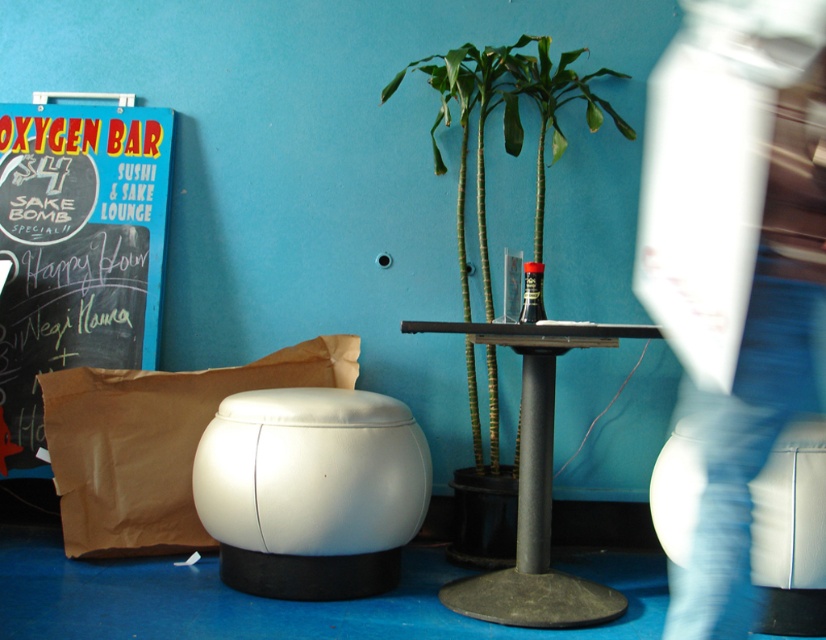
Question: Which object is farther from the camera taking this photo?

Choices:
 (A) black chalkboard at left
 (B) green leafy plant at center
 (C) brown paper bag at left

Answer: (A)

Question: Is white leather ottoman at center above metallic gray table at center?

Choices:
 (A) no
 (B) yes

Answer: (A)

Question: Does black chalkboard at left have a smaller size compared to white leather ottoman at center?

Choices:
 (A) yes
 (B) no

Answer: (A)

Question: Estimate the real-world distances between objects in this image. Which object is closer to the black chalkboard at left?

Choices:
 (A) green leafy plant at center
 (B) brown paper bag at left
 (C) white leather ottoman at center
 (D) metallic gray table at center

Answer: (B)

Question: Is black chalkboard at left closer to the viewer compared to green leafy plant at center?

Choices:
 (A) no
 (B) yes

Answer: (A)

Question: Which point is closer to the camera?

Choices:
 (A) (145, 380)
 (B) (573, 52)
 (C) (3, 372)
 (D) (532, 285)

Answer: (D)